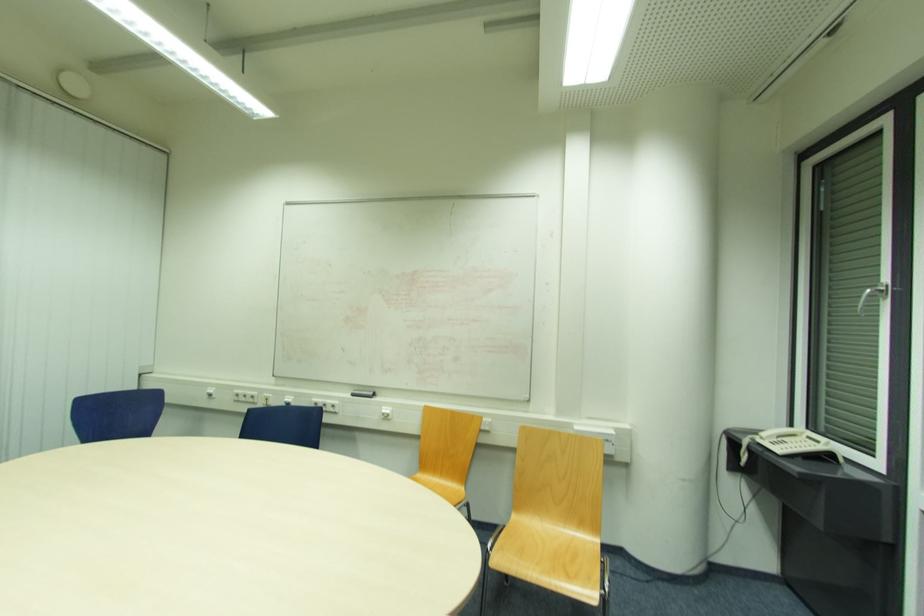
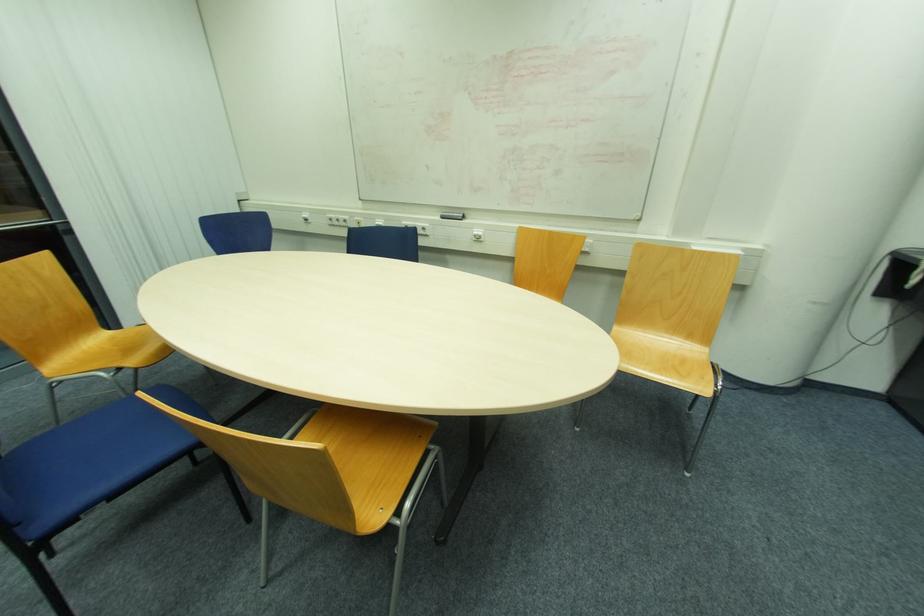
In the second image, find the point that corresponds to pixel 355 395 in the first image.

(444, 217)